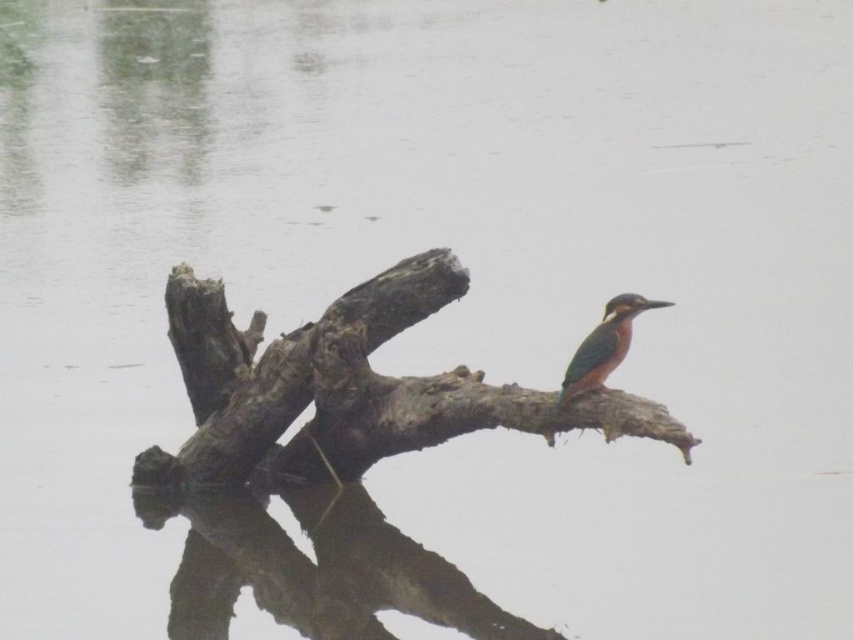
Does point (352, 465) lie in front of point (583, 364)?

No, it is not.

Between rough bark branch at center and green glossy bird at center, which one has less height?

With less height is green glossy bird at center.

Measure the distance between point (607, 397) and camera.

Point (607, 397) and camera are 6.20 meters apart.

The height and width of the screenshot is (640, 853). What are the coordinates of `rough bark branch at center` in the screenshot? It's located at coord(367,385).